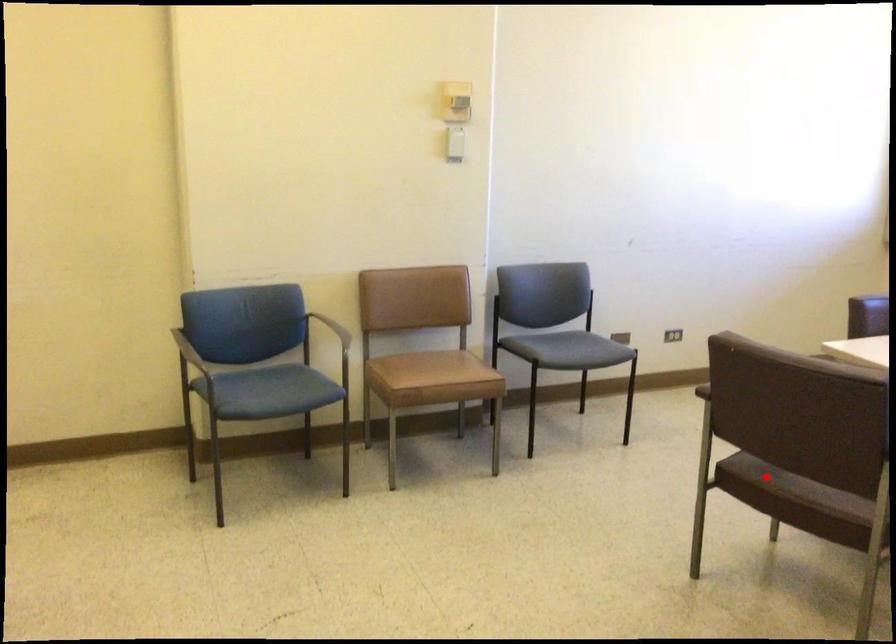
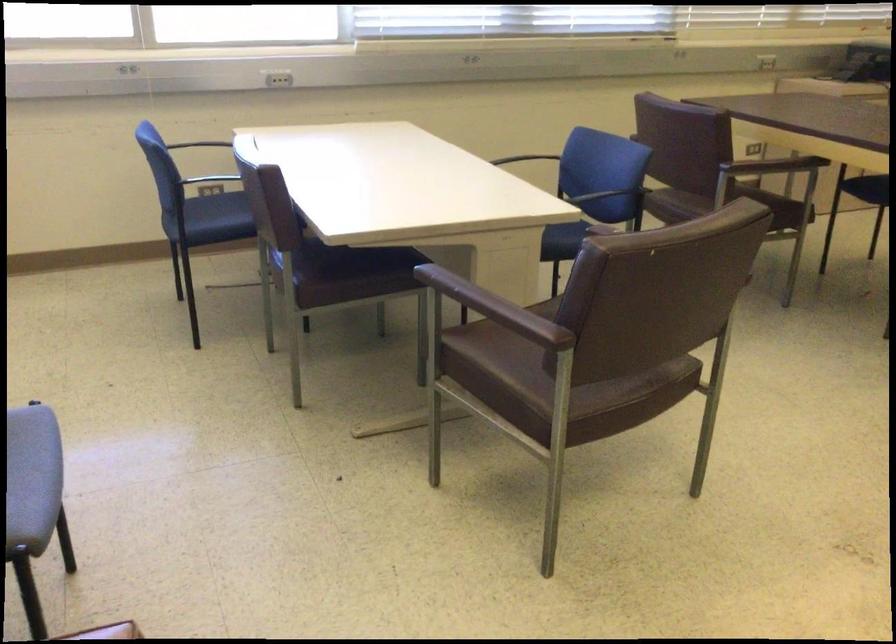
Where in the second image is the point corresponding to the highlighted location from the first image?

(588, 404)